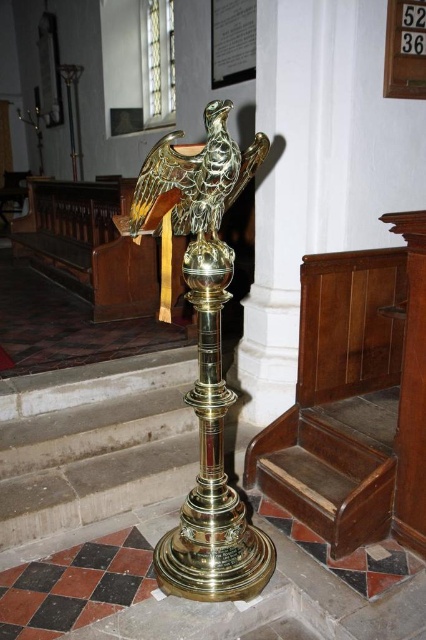
Who is taller, polished brass lectern at center or gold polished eagle at center?

polished brass lectern at center is taller.

Where is `polished brass lectern at center`? The image size is (426, 640). polished brass lectern at center is located at coordinates (212, 461).